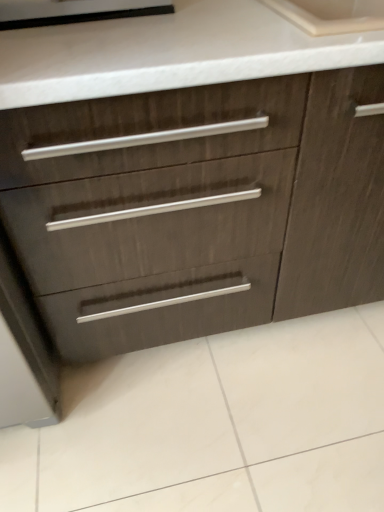
This screenshot has width=384, height=512. Find the location of `free spot to the right of black rubber seal at upper left`. free spot to the right of black rubber seal at upper left is located at coordinates (214, 19).